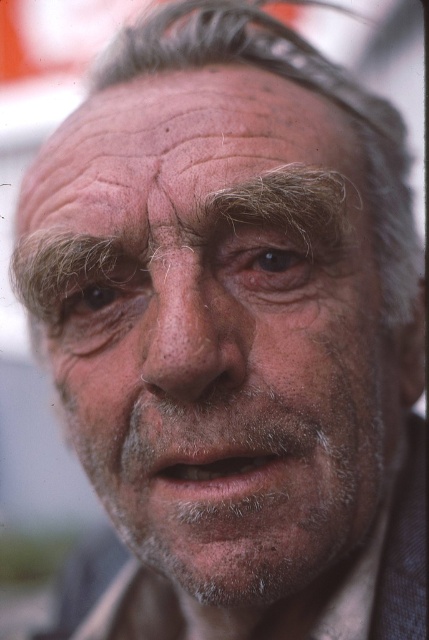
Where is `dry skin face at center`? The width and height of the screenshot is (429, 640). dry skin face at center is located at coordinates tap(214, 333).

Who is more forward, (114, 316) or (381, 282)?

Positioned in front is point (114, 316).

What are the coordinates of `dry skin face at center` in the screenshot? It's located at (214, 333).

Which is in front, point (395, 108) or point (232, 280)?

Positioned in front is point (232, 280).

Is point (163, 45) in front of point (301, 269)?

No, it is behind (301, 269).

Locate an element on the screen. gray/short hair at center is located at coordinates (299, 84).

Can you confirm if gray textured eyebrow at upper center is positioned to the left of brown matte eye at upper left?

In fact, gray textured eyebrow at upper center is to the right of brown matte eye at upper left.

Does point (180, 131) lie in front of point (114, 280)?

That is True.

You are a GUI agent. You are given a task and a screenshot of the screen. Output one action in this format:
    pyautogui.click(x=<x>, y=<y>)
    Task: Click on the gray textured eyebrow at upper center
    
    Given the screenshot: What is the action you would take?
    pyautogui.click(x=227, y=140)